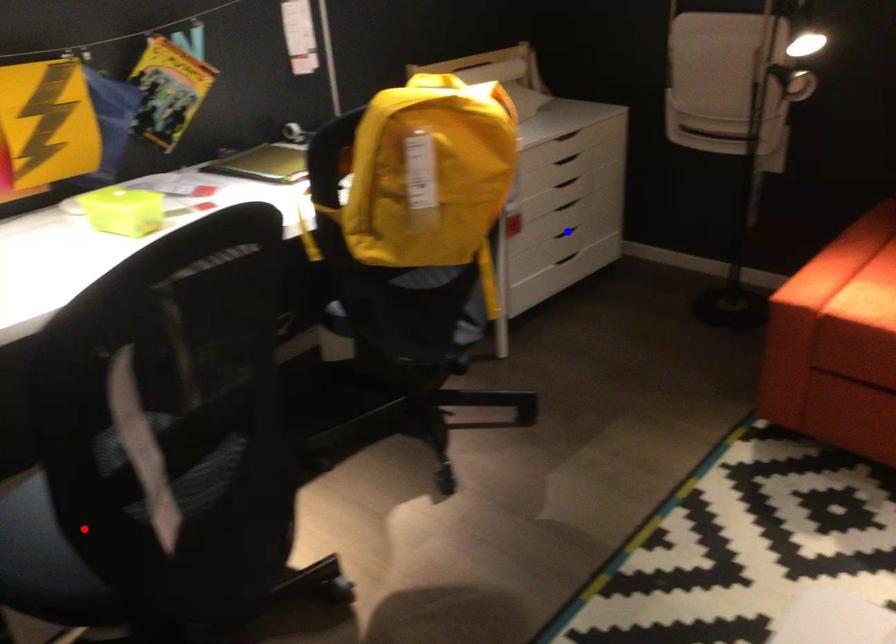
Question: Which of the two points in the image is closer to the camera?

Choices:
 (A) Blue point is closer.
 (B) Red point is closer.

Answer: (B)